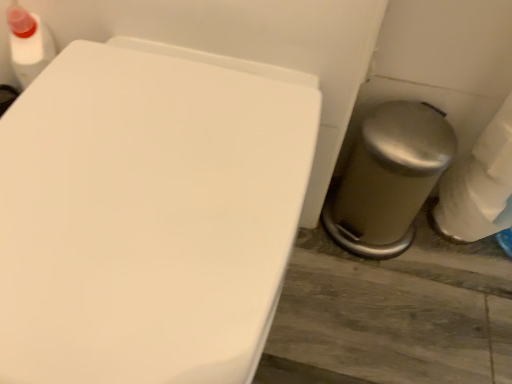
Identify the location of free point above white glossy toilet at center (from a real-world perspective). The width and height of the screenshot is (512, 384). (158, 172).